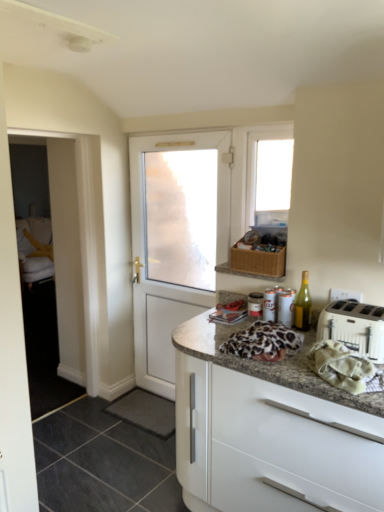
You are a GUI agent. You are given a task and a screenshot of the screen. Output one action in this format:
    pyautogui.click(x=<x>, y=<y>)
    Task: Click on the free point below white glossy screen door at left (from a real-world perspective)
    
    Given the screenshot: What is the action you would take?
    pyautogui.click(x=73, y=406)